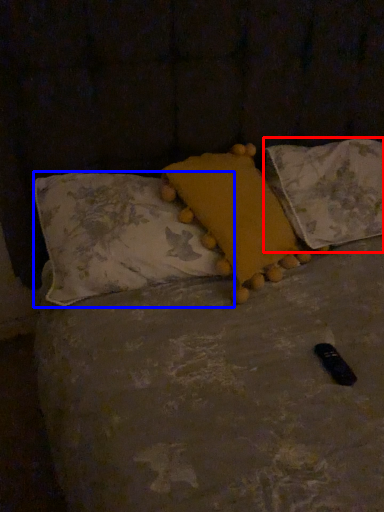
Question: Which object is further to the camera taking this photo, pillow (highlighted by a red box) or pillow (highlighted by a blue box)?

Choices:
 (A) pillow
 (B) pillow

Answer: (A)